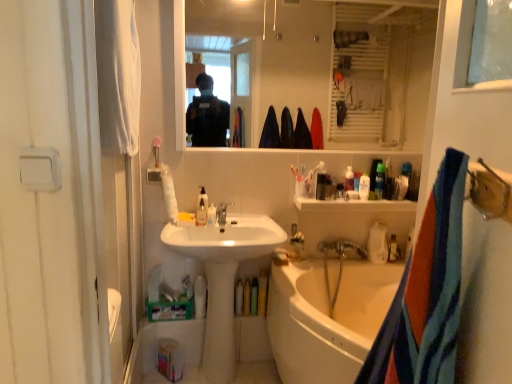
I want to click on vacant region to the left of translucent plastic soap dispenser at sink, which is the third bottle in back-to-front order, so click(180, 223).